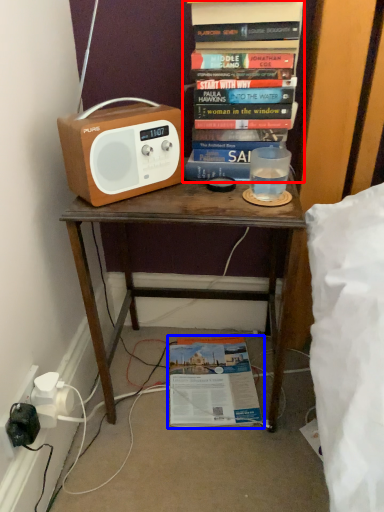
Question: Which of the following is the closest to the observer, book (highlighted by a red box) or book (highlighted by a blue box)?

Choices:
 (A) book
 (B) book

Answer: (A)